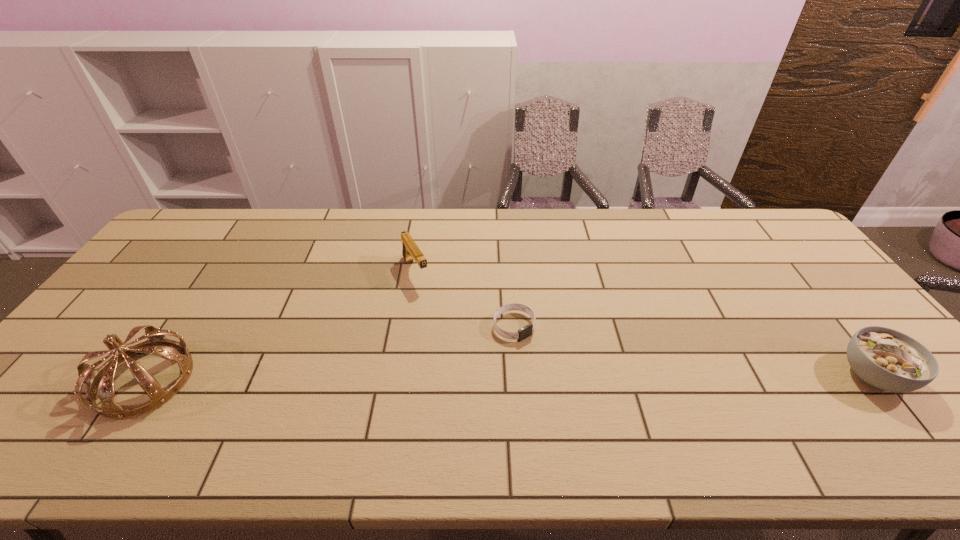
I want to click on free space on the desktop that is between the leftmost object and the rightmost object and is positioned at the barrel of the farthest object, so click(x=484, y=377).

The height and width of the screenshot is (540, 960). Find the location of `free spot on the desktop that is between the tiara and the rightmost object and is positioned on the outer surface of the shortest object`. free spot on the desktop that is between the tiara and the rightmost object and is positioned on the outer surface of the shortest object is located at coordinates coord(564,377).